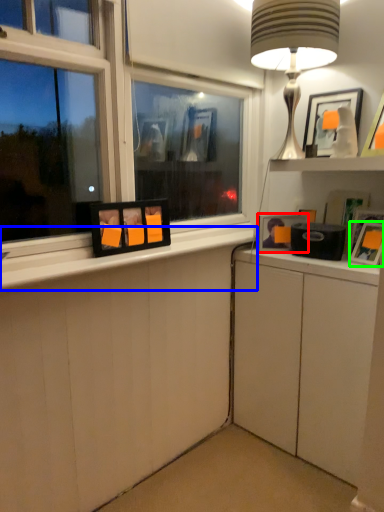
Question: Considering the real-world distances, which object is closest to picture frame (highlighted by a red box)? window sill (highlighted by a blue box) or picture frame (highlighted by a green box).

Choices:
 (A) window sill
 (B) picture frame

Answer: (B)